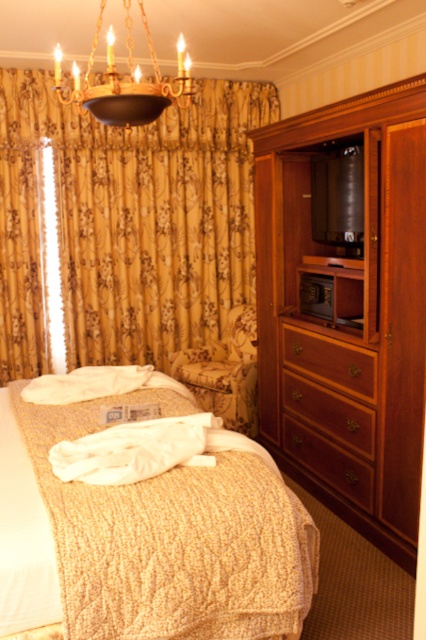
From the picture: You are standing in the hotel room and want to take a photo of both the bed and the armoire. You notice two points marked in the room at coordinates point (34, 419) and point (301, 460). Which point should you stand closer to ensure both the bed and the armoire are in frame?

You should stand closer to point (34, 419) because it is closer to the camera, allowing both the bed and the armoire to be within the frame.

You are a hotel guest who wants to place a tall lamp on the wooden dresser at right and the brown wood drawer at center. Based on their heights, which surface can accommodate the lamp without it being too unstable?

The wooden dresser at right is much taller than the brown wood drawer at center, so placing the tall lamp on the wooden dresser at right would provide a more stable surface since it can support the lamp better due to its height.